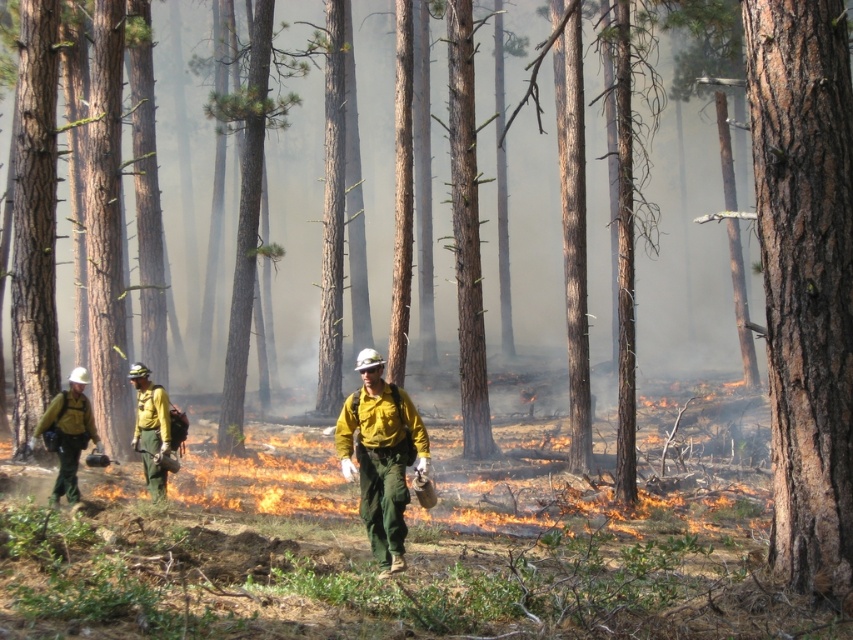
Question: Can you confirm if brown rough bark tree at right is positioned below yellow-green fabric uniform at center?

Choices:
 (A) yes
 (B) no

Answer: (B)

Question: Among these points, which one is farthest from the camera?

Choices:
 (A) (381, 477)
 (B) (152, 461)
 (C) (68, 488)

Answer: (B)

Question: Does yellow matte uniform at center appear on the left side of yellow fabric helmet at center?

Choices:
 (A) yes
 (B) no

Answer: (A)

Question: Which of these objects is positioned farthest from the yellow-green fabric uniform at center?

Choices:
 (A) yellow fabric helmet at center
 (B) brown rough bark tree at right
 (C) yellow matte uniform at center

Answer: (C)

Question: Which point appears closest to the camera in this image?

Choices:
 (A) (88, 416)
 (B) (821, 573)

Answer: (B)

Question: From the image, what is the correct spatial relationship of yellow-green fabric uniform at center in relation to yellow matte uniform at center?

Choices:
 (A) above
 (B) below

Answer: (A)